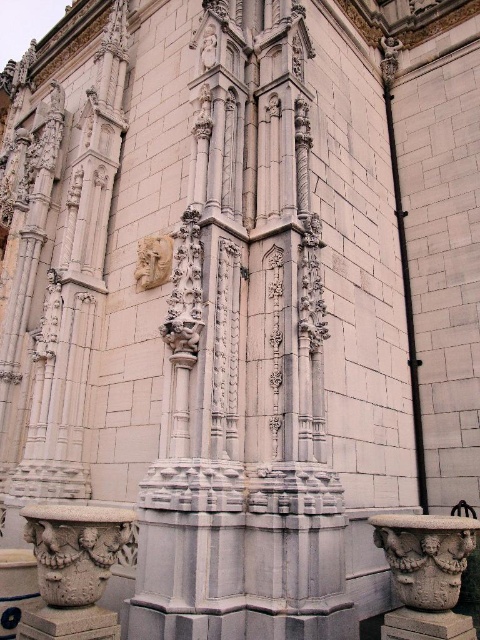
You are an architect examining the building facade. You need to determine which object is nearer to you between the carved stone vase at lower right and the white stone sculpture at center. Which one is closer?

The carved stone vase at lower right is closer to the viewer than the white stone sculpture at center.

You are an architect examining the building facade and need to place a new decorative element between the white stone column at lower left and the carved stone vase at lower right. Based on their positions, which object should you place the new element closer to?

The white stone column at lower left is positioned on the left side of the carved stone vase at lower right, so the new element should be placed closer to the white stone column at lower left to maintain symmetry with the existing decorative elements.

You are an architect examining the building facade and need to determine the spatial relationship between the white stone sculpture at center and the white stone mask at center. Which one appears closer to you from your current viewpoint?

A: The white stone sculpture at center is closer to the viewer than the white stone mask at center.